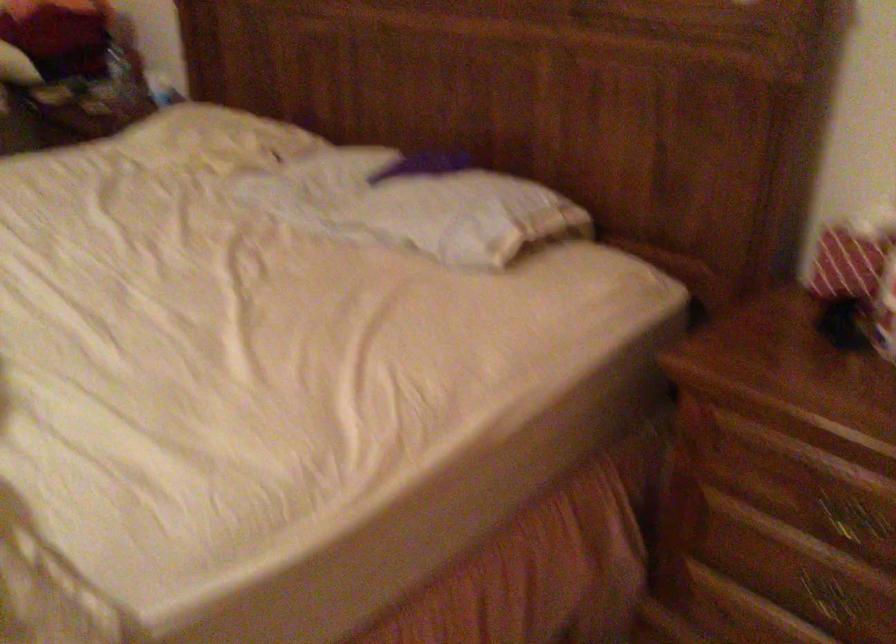
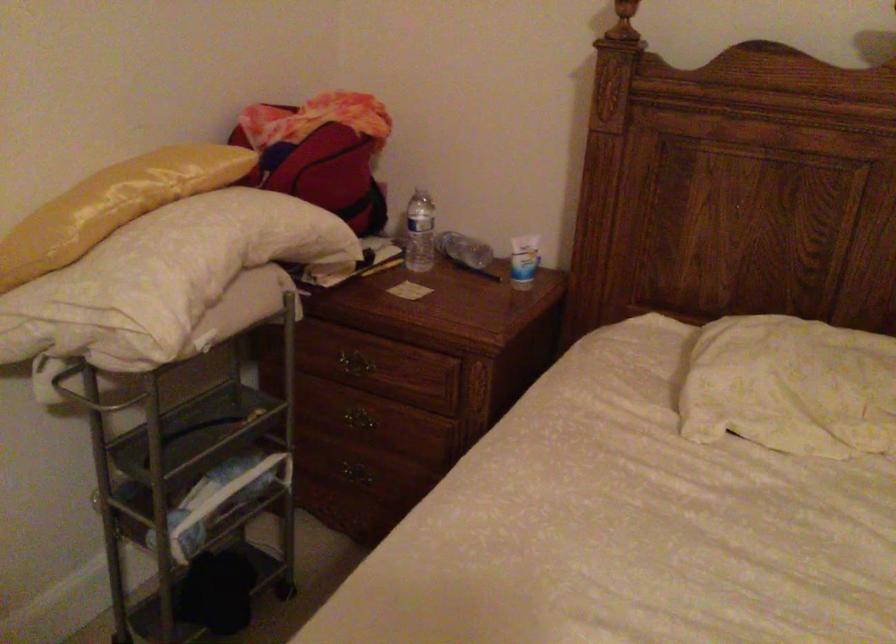
Find the pixel in the second image that matches [168,82] in the first image.

(523, 261)